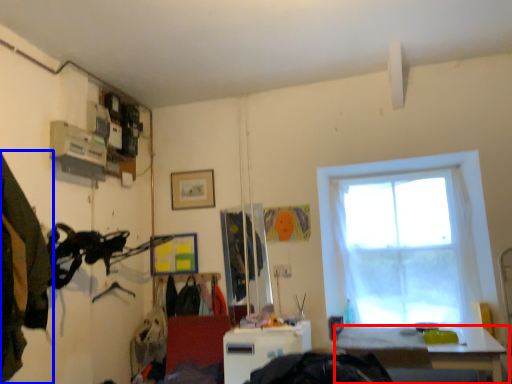
Question: Which object appears closest to the camera in this image, table (highlighted by a red box) or clothing (highlighted by a blue box)?

Choices:
 (A) table
 (B) clothing

Answer: (B)